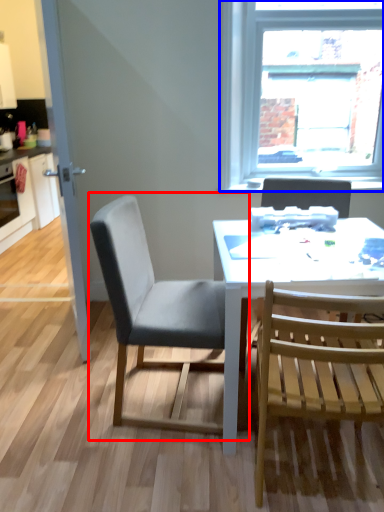
Question: Which of the following is the farthest to the observer, chair (highlighted by a red box) or window (highlighted by a blue box)?

Choices:
 (A) chair
 (B) window

Answer: (B)